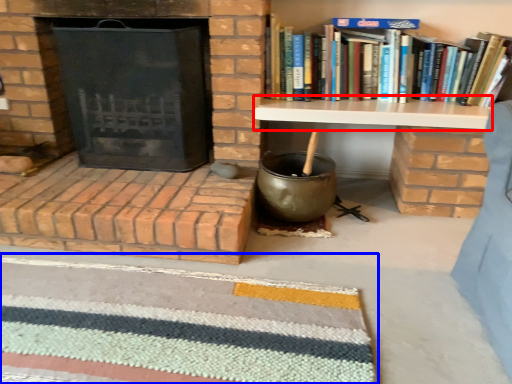
Question: Which of the following is the farthest to the observer, table (highlighted by a red box) or doormat (highlighted by a blue box)?

Choices:
 (A) table
 (B) doormat

Answer: (A)